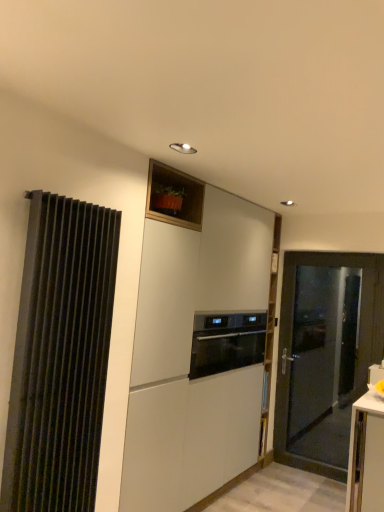
In order to face matte black door at right, should I rotate leftwards or rightwards?

Rotate your view right by about 17.031°.

What do you see at coordinates (226, 342) in the screenshot? I see `black glass oven at center` at bounding box center [226, 342].

You are a GUI agent. You are given a task and a screenshot of the screen. Output one action in this format:
    pyautogui.click(x=<x>, y=<y>)
    Task: Click on the black glass oven at center
    The image size is (384, 512).
    Given the screenshot: What is the action you would take?
    pyautogui.click(x=226, y=342)

What do you see at coordinates (60, 356) in the screenshot?
I see `black ribbed curtain at left` at bounding box center [60, 356].

What do you see at coordinates (196, 345) in the screenshot? I see `white matte cabinet at center` at bounding box center [196, 345].

What is the approximate height of white matte cabinet at center?

white matte cabinet at center is 7.85 feet tall.

What are the coordinates of `matte black door at right` in the screenshot? It's located at (325, 354).

Considering the relative sizes of white matte cabinet at center and black ribbed curtain at left in the image provided, is white matte cabinet at center smaller than black ribbed curtain at left?

No, white matte cabinet at center is not smaller than black ribbed curtain at left.

Between point (213, 333) and point (77, 506), which one is positioned in front?

The point (77, 506) is closer.

Which is behind, white matte cabinet at center or black ribbed curtain at left?

white matte cabinet at center is further away from the camera.

In the scene shown: How many degrees apart are the facing directions of white matte cabinet at center and black ribbed curtain at left?

They differ by 0.389 degrees in their facing directions.

Can you confirm if black ribbed curtain at left is wider than white matte cabinet at center?

No, black ribbed curtain at left is not wider than white matte cabinet at center.

Does black ribbed curtain at left lie behind white matte cabinet at center?

No, black ribbed curtain at left is closer to the viewer.

Who is bigger, black ribbed curtain at left or white matte cabinet at center?

Bigger between the two is white matte cabinet at center.

Is white matte cabinet at center to the right of black glass oven at center from the viewer's perspective?

In fact, white matte cabinet at center is to the left of black glass oven at center.

Is black glass oven at center surrounded by white matte cabinet at center?

Yes, black glass oven at center can be found within white matte cabinet at center.

Does white matte cabinet at center have a greater width compared to black glass oven at center?

In fact, white matte cabinet at center might be narrower than black glass oven at center.

Is matte black door at right oriented towards white matte cabinet at center?

Yes, matte black door at right is aimed at white matte cabinet at center.

From a real-world perspective, is matte black door at right located higher than white matte cabinet at center?

No, from a real-world perspective, matte black door at right is not above white matte cabinet at center.

Can you confirm if matte black door at right is smaller than white matte cabinet at center?

Yes.

In the scene shown: Is the depth of matte black door at right greater than that of white matte cabinet at center?

Yes, the depth of matte black door at right is greater than that of white matte cabinet at center.

How many degrees apart are the facing directions of black glass oven at center and white matte cabinet at center?

0.00118 degrees separate the facing orientations of black glass oven at center and white matte cabinet at center.

Is black glass oven at center to the right of white matte cabinet at center from the viewer's perspective?

Yes.

Are black glass oven at center and white matte cabinet at center far apart?

Actually, black glass oven at center and white matte cabinet at center are a little close together.

Considering the sizes of objects matte black door at right and black ribbed curtain at left in the image provided, who is wider, matte black door at right or black ribbed curtain at left?

matte black door at right is wider.

Is matte black door at right positioned beyond the bounds of black ribbed curtain at left?

Indeed, matte black door at right is completely outside black ribbed curtain at left.

How different are the orientations of matte black door at right and black ribbed curtain at left in degrees?

89.8 degrees.

Is black glass oven at center positioned behind black ribbed curtain at left?

Yes.

Which is more to the right, black glass oven at center or black ribbed curtain at left?

Positioned to the right is black glass oven at center.

From the picture: Is black glass oven at center facing away from black ribbed curtain at left?

No, black glass oven at center's orientation is not away from black ribbed curtain at left.

Is black glass oven at center inside the boundaries of black ribbed curtain at left, or outside?

black glass oven at center is spatially situated outside black ribbed curtain at left.

This screenshot has height=512, width=384. Find the location of `curtain located in front of the white matte cabinet at center`. curtain located in front of the white matte cabinet at center is located at coordinates (60, 356).

You are a GUI agent. You are given a task and a screenshot of the screen. Output one action in this format:
    pyautogui.click(x=<x>, y=<y>)
    Task: Click on the curtain to the left of white matte cabinet at center
    Image resolution: width=384 pixels, height=512 pixels.
    Given the screenshot: What is the action you would take?
    pyautogui.click(x=60, y=356)

Based on their spatial positions, is white matte cabinet at center or matte black door at right further from black glass oven at center?

matte black door at right is further to black glass oven at center.

Considering their positions, is black glass oven at center positioned further to white matte cabinet at center than black ribbed curtain at left?

black ribbed curtain at left.

Based on their spatial positions, is matte black door at right or white matte cabinet at center further from black ribbed curtain at left?

matte black door at right is positioned further to the anchor black ribbed curtain at left.

When comparing their distances from matte black door at right, does black glass oven at center or white matte cabinet at center seem closer?

The object closer to matte black door at right is black glass oven at center.

Estimate the real-world distances between objects in this image. Which object is closer to black ribbed curtain at left, black glass oven at center or matte black door at right?

black glass oven at center is closer to black ribbed curtain at left.

Looking at the image, which one is located further to matte black door at right, white matte cabinet at center or black ribbed curtain at left?

black ribbed curtain at left is positioned further to the anchor matte black door at right.

When comparing their distances from black glass oven at center, does matte black door at right or black ribbed curtain at left seem closer?

matte black door at right is closer to black glass oven at center.

Looking at the image, which one is located further to black ribbed curtain at left, black glass oven at center or white matte cabinet at center?

black glass oven at center is positioned further to the anchor black ribbed curtain at left.

Where is `home appliance between black ribbed curtain at left and matte black door at right along the z-axis`? This screenshot has height=512, width=384. home appliance between black ribbed curtain at left and matte black door at right along the z-axis is located at coordinates (226, 342).

Where is `cabinetry located between black ribbed curtain at left and matte black door at right in the depth direction`? cabinetry located between black ribbed curtain at left and matte black door at right in the depth direction is located at coordinates (196, 345).

Where is `home appliance between white matte cabinet at center and matte black door at right along the z-axis`? This screenshot has width=384, height=512. home appliance between white matte cabinet at center and matte black door at right along the z-axis is located at coordinates (226, 342).

In order to click on cabinetry positioned between black ribbed curtain at left and black glass oven at center from near to far in this screenshot , I will do `click(196, 345)`.